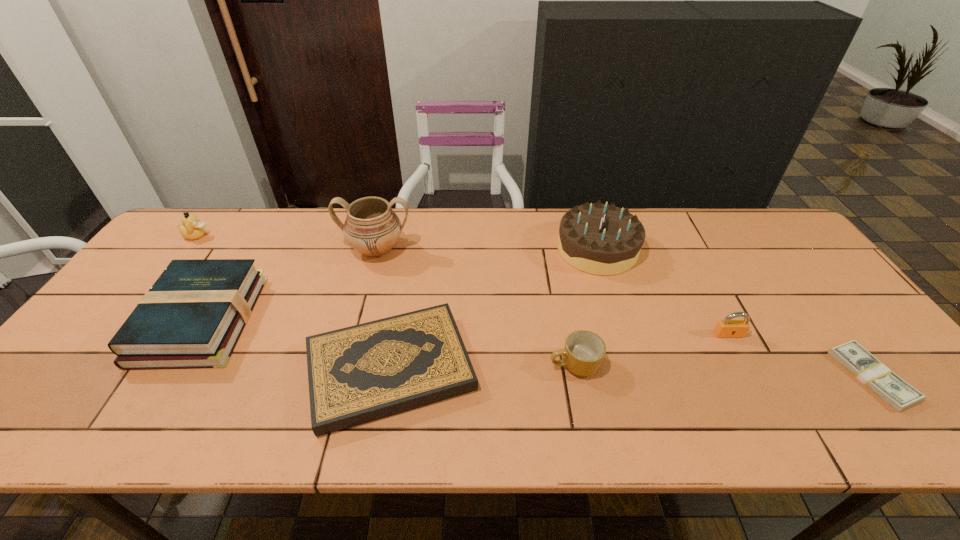
Identify the location of the tallest object. Image resolution: width=960 pixels, height=540 pixels. (372, 228).

This screenshot has height=540, width=960. What are the coordinates of `the seventh shortest object` in the screenshot? It's located at (599, 239).

Locate an element on the screen. the leftmost object is located at coordinates (192, 228).

Identify the location of the second object from left to right. The image size is (960, 540). (192, 317).

Locate an element on the screen. the left hardback book is located at coordinates (192, 317).

Image resolution: width=960 pixels, height=540 pixels. What are the coordinates of `padlock` in the screenshot? It's located at (727, 328).

The image size is (960, 540). In order to click on mug in this screenshot , I will do `click(583, 354)`.

Image resolution: width=960 pixels, height=540 pixels. I want to click on the right hardback book, so click(x=358, y=374).

The height and width of the screenshot is (540, 960). Identify the location of the shorter hardback book. (358, 374).

What are the coordinates of `the rightmost object` in the screenshot? It's located at (897, 393).